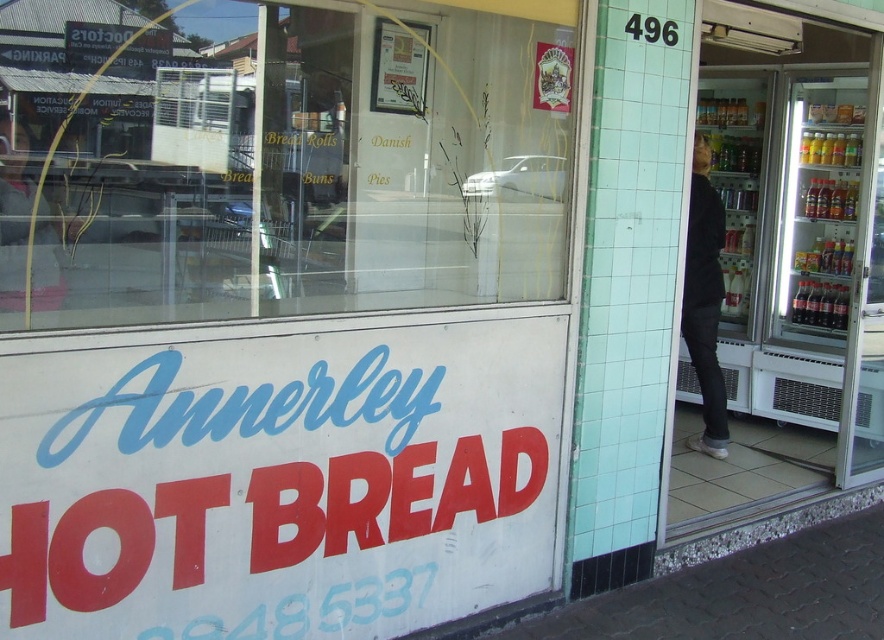
Is transparent glass at center taller than black matte jacket at right?

No.

Locate an element on the screen. Image resolution: width=884 pixels, height=640 pixels. transparent glass at center is located at coordinates (293, 168).

Which is in front, point (103, 300) or point (713, 296)?

Point (103, 300) is in front.

You are a GUI agent. You are given a task and a screenshot of the screen. Output one action in this format:
    pyautogui.click(x=<x>, y=<y>)
    Task: Click on the transparent glass at center
    This screenshot has height=640, width=884.
    Given the screenshot: What is the action you would take?
    pyautogui.click(x=293, y=168)

Which is more to the left, transparent glass door at right or black matte jacket at right?

Positioned to the left is black matte jacket at right.

Is point (863, 144) in front of point (696, 266)?

That is False.

At what (x,y) coordinates should I click in order to perform the action: click on transparent glass door at right. Please return your answer as a coordinate pair (x, y). This screenshot has width=884, height=640. Looking at the image, I should click on coord(793,269).

Does transparent glass at center have a smaller size compared to matte black jacket at left?

No.

Find the location of a particular element. Image resolution: width=884 pixels, height=640 pixels. transparent glass at center is located at coordinates (293, 168).

At what (x,y) coordinates should I click in order to perform the action: click on transparent glass at center. Please return your answer as a coordinate pair (x, y). Looking at the image, I should click on (293, 168).